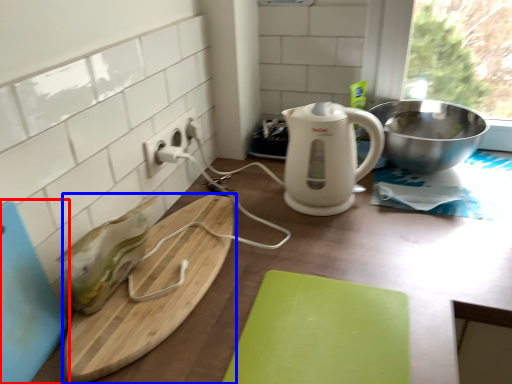
Question: Which of the following is the farthest to the observer, cutting board (highlighted by a red box) or cutting board (highlighted by a blue box)?

Choices:
 (A) cutting board
 (B) cutting board

Answer: (B)